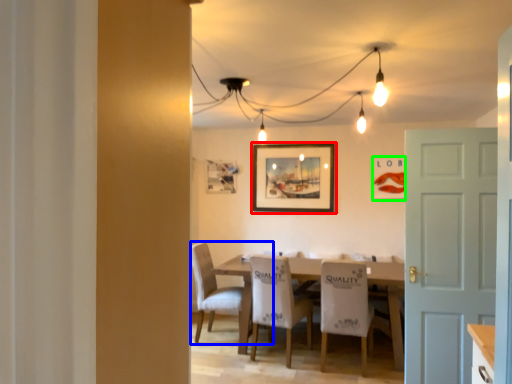
Question: Which object is the closest to the picture frame (highlighted by a red box)? Choose among these: chair (highlighted by a blue box) or picture frame (highlighted by a green box).

Choices:
 (A) chair
 (B) picture frame

Answer: (B)